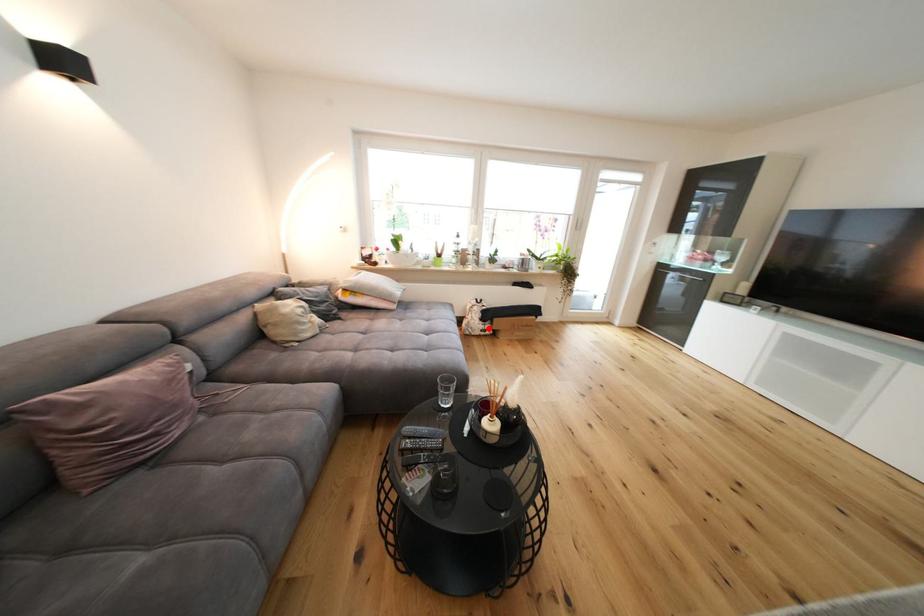
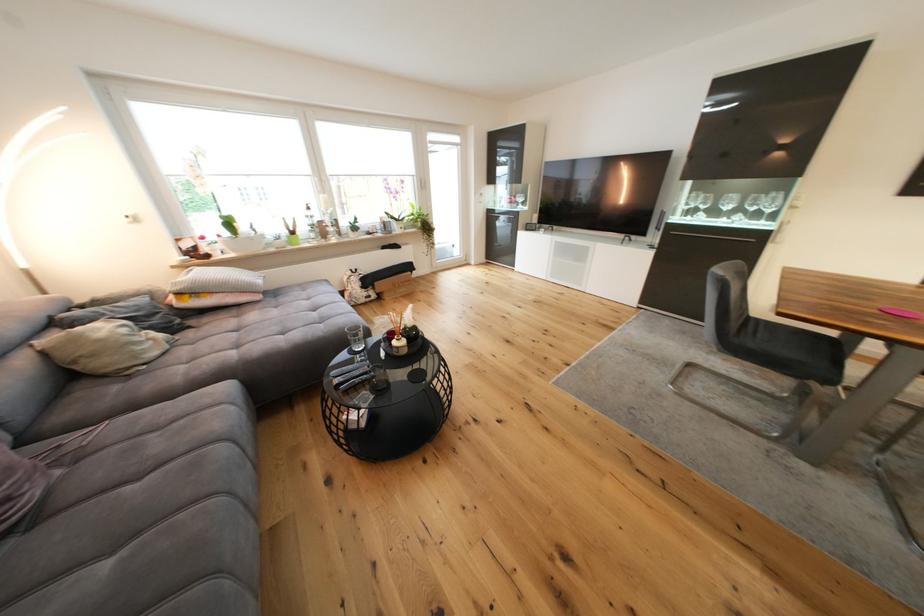
Find the pixel in the second image that matches the highlighted location in the first image.

(372, 296)